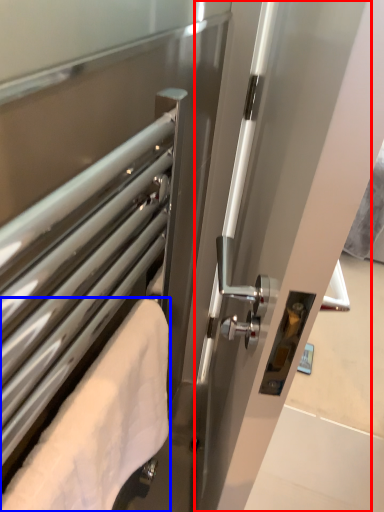
Question: Which object is further to the camera taking this photo, screen door (highlighted by a red box) or towel (highlighted by a blue box)?

Choices:
 (A) screen door
 (B) towel

Answer: (B)